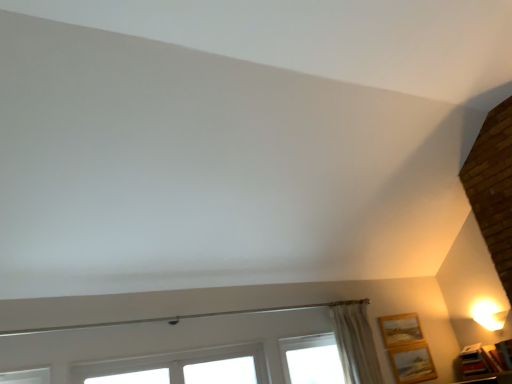
Question: From a real-world perspective, is wooden picture frame at lower right, positioned as the third picture frame in right-to-left order, below white plastic window at lower center?

Choices:
 (A) no
 (B) yes

Answer: (A)

Question: Considering the relative sizes of wooden picture frame at lower right, the first picture frame from the left, and white plastic window at lower center in the image provided, is wooden picture frame at lower right, the first picture frame from the left, bigger than white plastic window at lower center?

Choices:
 (A) no
 (B) yes

Answer: (A)

Question: Is wooden picture frame at lower right, the first picture frame from the left, with white plastic window at lower center?

Choices:
 (A) yes
 (B) no

Answer: (B)

Question: Is wooden picture frame at lower right, the first picture frame from the left, to the right of white plastic window at lower center from the viewer's perspective?

Choices:
 (A) no
 (B) yes

Answer: (B)

Question: Does wooden picture frame at lower right, the first picture frame from the left, appear on the left side of white plastic window at lower center?

Choices:
 (A) yes
 (B) no

Answer: (B)

Question: Visually, is white plastic window at lower center positioned to the left or to the right of wooden picture frame at lower right, which is counted as the first picture frame, starting from the right?

Choices:
 (A) right
 (B) left

Answer: (B)

Question: From the image's perspective, is white plastic window at lower center above or below wooden picture frame at lower right, which is counted as the first picture frame, starting from the right?

Choices:
 (A) above
 (B) below

Answer: (A)

Question: Looking at their shapes, would you say white plastic window at lower center is wider or thinner than wooden picture frame at lower right, positioned as the third picture frame in left-to-right order?

Choices:
 (A) thin
 (B) wide

Answer: (A)

Question: Is white plastic window at lower center spatially inside wooden picture frame at lower right, positioned as the third picture frame in left-to-right order, or outside of it?

Choices:
 (A) outside
 (B) inside

Answer: (A)

Question: Looking at their shapes, would you say wooden picture frame at lower right, positioned as the third picture frame in left-to-right order, is wider or thinner than wooden picture frame at lower right, the first picture frame from the left?

Choices:
 (A) wide
 (B) thin

Answer: (A)

Question: Considering their positions, is wooden picture frame at lower right, positioned as the third picture frame in left-to-right order, located in front of or behind wooden picture frame at lower right, the first picture frame from the left?

Choices:
 (A) front
 (B) behind

Answer: (A)

Question: From the image's perspective, is wooden picture frame at lower right, positioned as the third picture frame in left-to-right order, above or below wooden picture frame at lower right, the first picture frame from the left?

Choices:
 (A) below
 (B) above

Answer: (A)

Question: From a real-world perspective, is wooden picture frame at lower right, positioned as the third picture frame in left-to-right order, physically located above or below wooden picture frame at lower right, positioned as the third picture frame in right-to-left order?

Choices:
 (A) below
 (B) above

Answer: (A)

Question: From a real-world perspective, is white plastic window at lower center positioned above or below wooden picture frame at lower right, arranged as the 2th picture frame when viewed from the right?

Choices:
 (A) below
 (B) above

Answer: (B)

Question: Considering the positions of point (199, 365) and point (406, 377), is point (199, 365) closer or farther from the camera than point (406, 377)?

Choices:
 (A) closer
 (B) farther

Answer: (A)